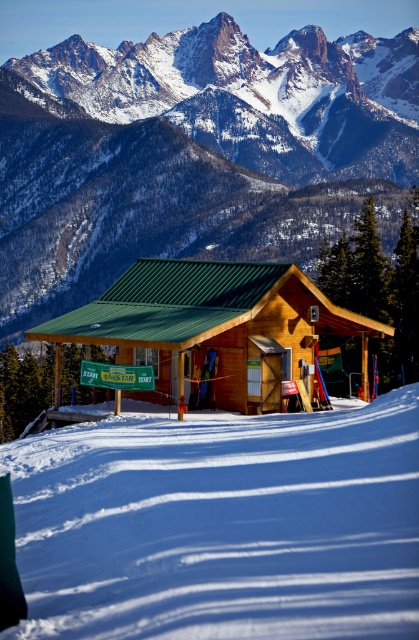
You are navigating a drone over the snowy landscape and need to drop a package at the exact coordinates of the snowy rock at upper center. What are the coordinates where you should drop the package?

The coordinates for the snowy rock at upper center are 0.239 in the x and 0.456 in the y direction.

You are planning to build a snowman using the white snow at center near the wooden cabin at center. Considering their sizes, will the snowman be taller than the cabin?

The white snow at center is smaller than the wooden cabin at center, so the snowman made from the snow will not be taller than the cabin.